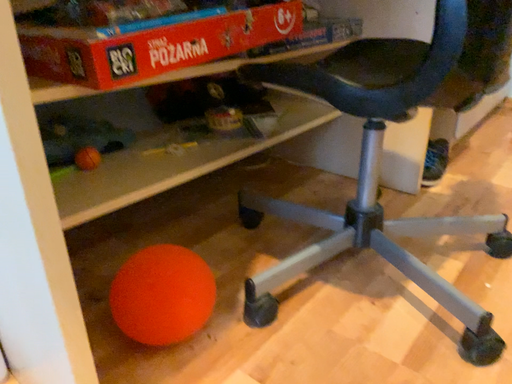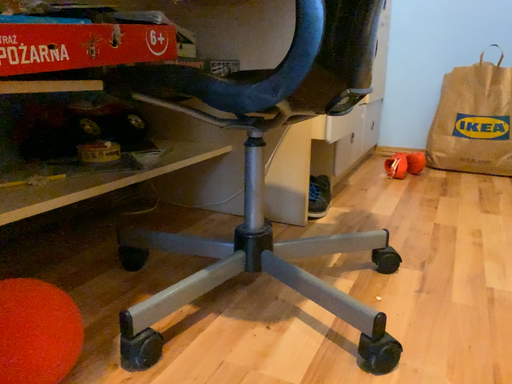
Question: Which way did the camera rotate in the video?

Choices:
 (A) rotated upward
 (B) rotated downward

Answer: (A)